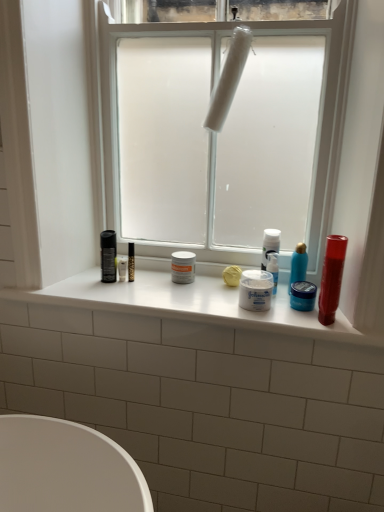
Where is `vacant space that's between shiny red tube at right and white matte jar at center, the third toiletry positioned from the right`? This screenshot has height=512, width=384. vacant space that's between shiny red tube at right and white matte jar at center, the third toiletry positioned from the right is located at coordinates (296, 313).